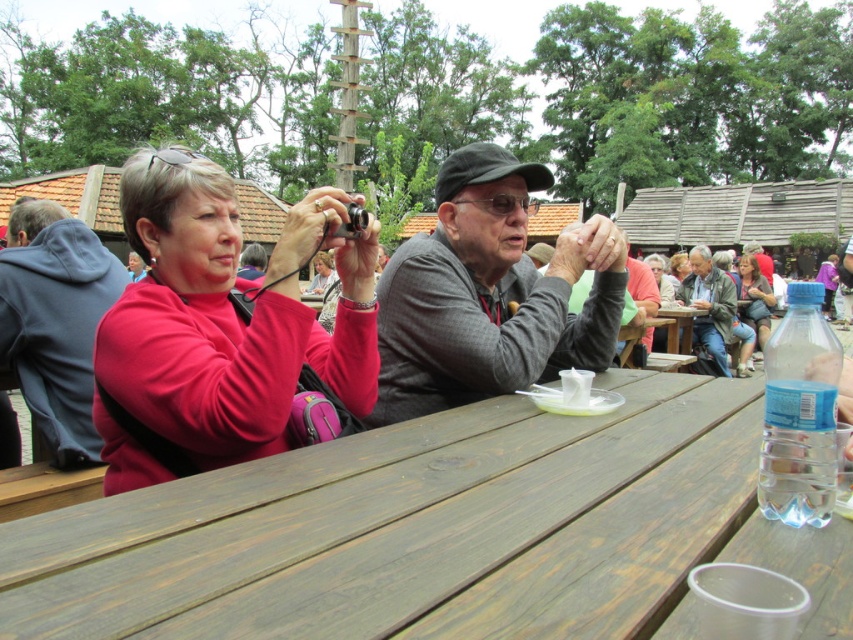
You are a photographer trying to capture both the matte red sweater at left and the gray woolen sweater at center in a single shot. Based on their positions, which sweater will appear closer to the camera in the photo?

The matte red sweater at left will appear closer to the camera in the photo because it is positioned in front of the gray woolen sweater at center.

You are standing in front of the wooden table where the two people are sitting. You notice two points marked on the table surface. The first point is at coordinates point (x=722, y=285) and the second point is at point (x=833, y=278). Which of these two points is closer to you?

Point (x=722, y=285) is closer to the viewer than point (x=833, y=278).

Based on the photo, you are standing at the edge of the gathering area and see two people sitting at the table. Which person is wearing the gray woolen sweater at center located to the left side of the purple fabric dress at center?

The gray woolen sweater at center is to the left of the purple fabric dress at center, so the person wearing the gray woolen sweater at center is seated to the left of the one in the purple fabric dress at center.